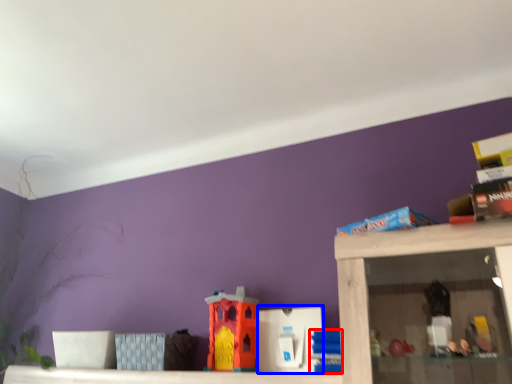
Question: Which of the following is the farthest to the observer, toy (highlighted by a red box) or toy (highlighted by a blue box)?

Choices:
 (A) toy
 (B) toy

Answer: (B)